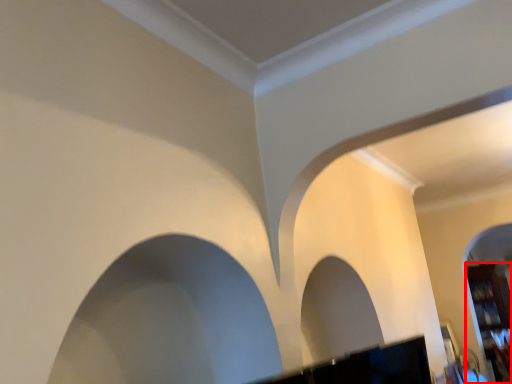
Question: From the image's perspective, what is the correct spatial positioning of furniture (annotated by the red box) in reference to rock arch?

Choices:
 (A) below
 (B) above

Answer: (A)